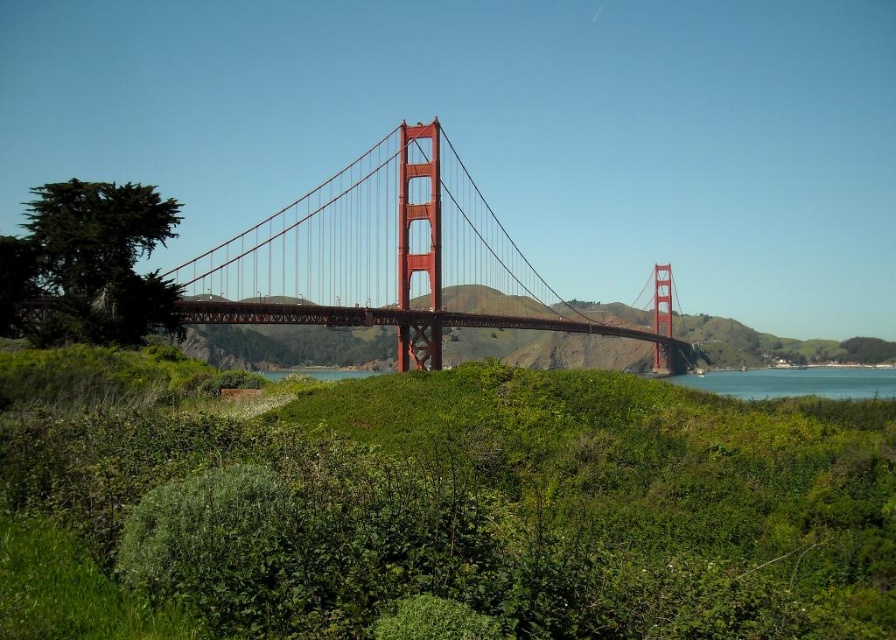
Question: Which of the following is the farthest from the observer?

Choices:
 (A) glossy steel bridge at center
 (B) green leafy tree at left
 (C) blue water at lower center

Answer: (C)

Question: Can you confirm if green leafy shrubs at center is wider than glossy steel bridge at center?

Choices:
 (A) yes
 (B) no

Answer: (B)

Question: Which object is the closest to the blue water at lower center?

Choices:
 (A) green leafy shrubs at center
 (B) green leafy tree at left

Answer: (A)

Question: Among these points, which one is nearest to the camera?

Choices:
 (A) (543, 461)
 (B) (436, 356)
 (C) (29, 227)

Answer: (A)

Question: Is glossy steel bridge at center behind green leafy tree at left?

Choices:
 (A) yes
 (B) no

Answer: (A)

Question: Does green leafy shrubs at center appear under green leafy tree at left?

Choices:
 (A) yes
 (B) no

Answer: (A)